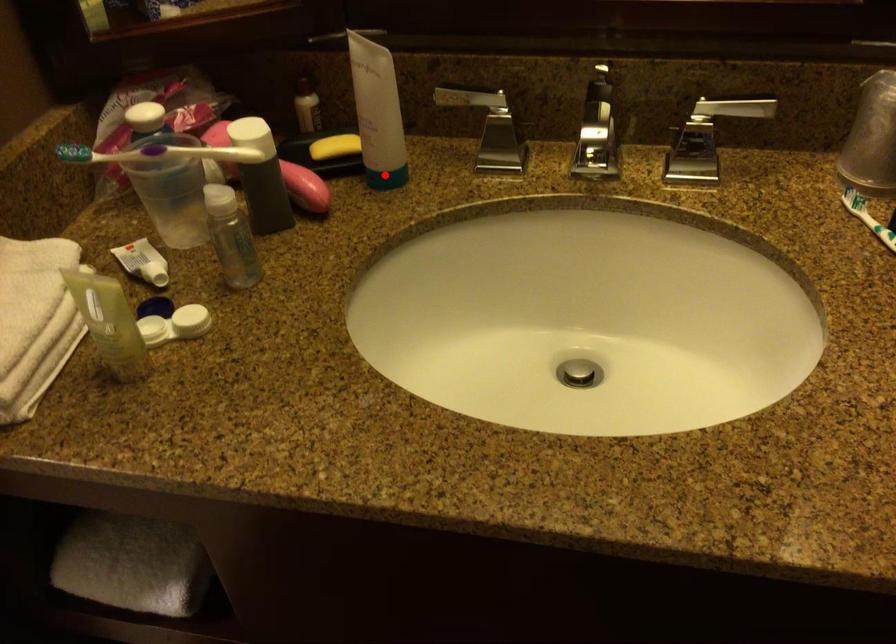
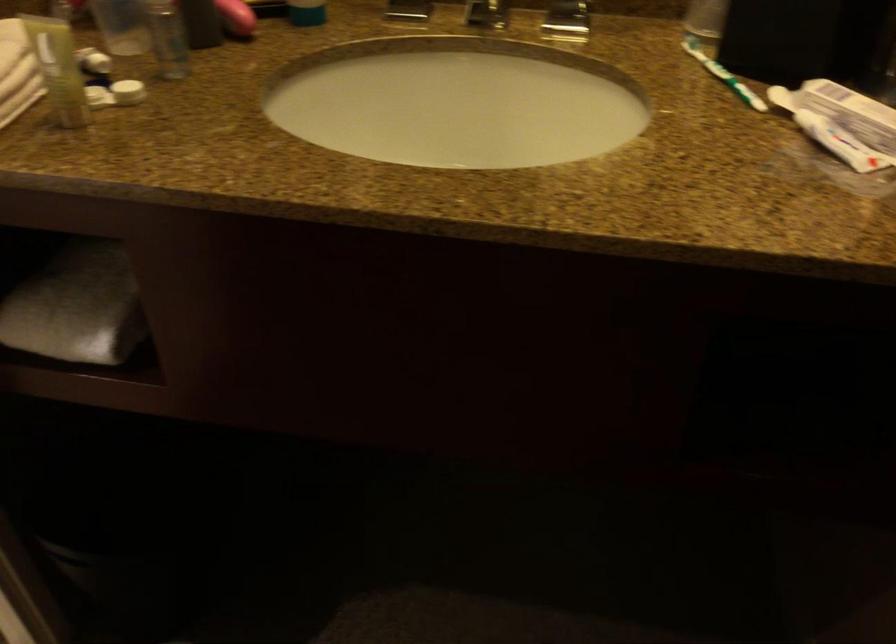
Question: I am providing you with two images of the same scene from different viewpoints. Given a red point in image1, look at the same physical point in image2. Is it:

Choices:
 (A) Closer to the viewpoint
 (B) Farther from the viewpoint

Answer: (B)